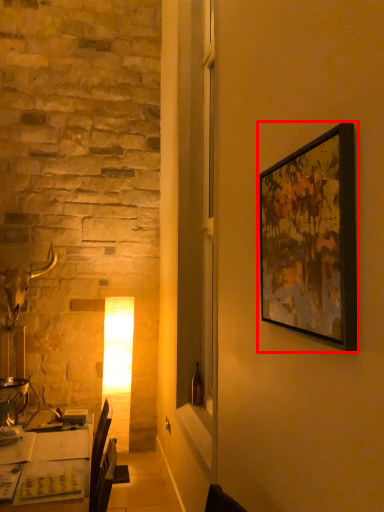
Question: From the image's perspective, where is picture frame (annotated by the red box) located relative to table?

Choices:
 (A) below
 (B) above

Answer: (B)